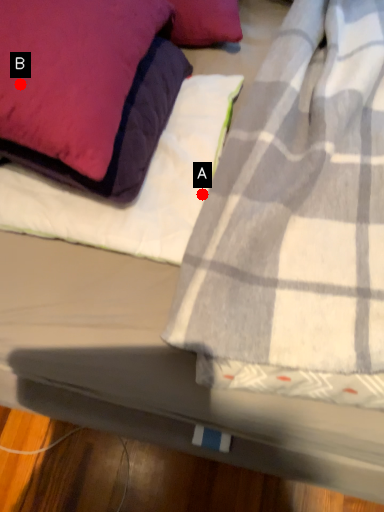
Question: Two points are circled on the image, labeled by A and B beside each circle. Which point appears closest to the camera in this image?

Choices:
 (A) A is closer
 (B) B is closer

Answer: (B)